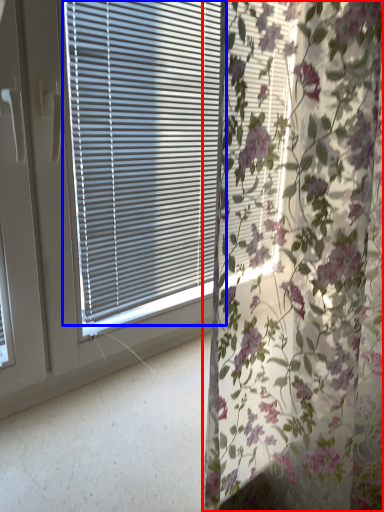
Question: Which object appears farthest to the camera in this image, curtain (highlighted by a red box) or window blind (highlighted by a blue box)?

Choices:
 (A) curtain
 (B) window blind

Answer: (B)